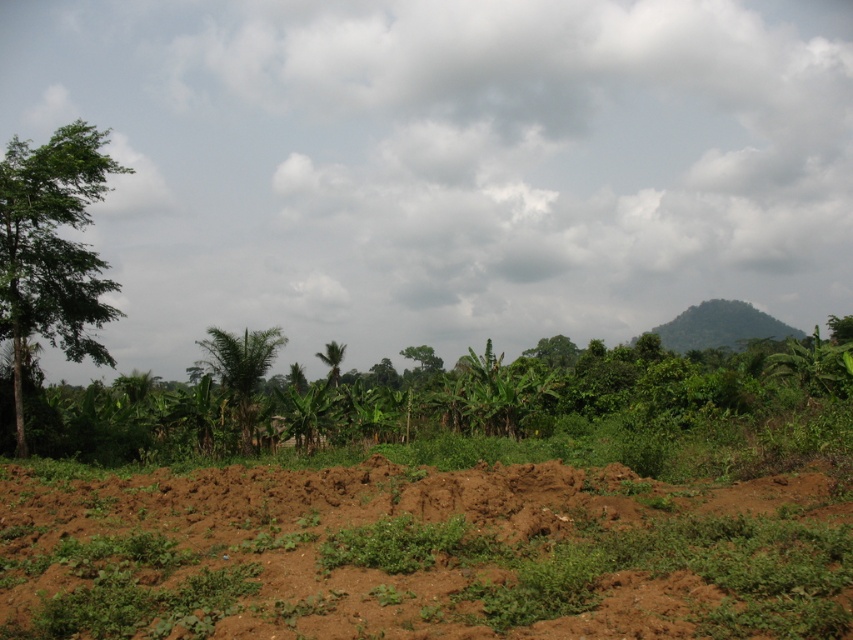
You are a farmer checking your field. You see the brown soil at lower center and the green leafy tree at left. Which one is more to the left?

The green leafy tree at left is more to the left.

You are standing in the rural landscape and want to place a small flag at each of the two points, point (45, 252) and point (250, 417). Which point will have its flag appear closer to you when viewed from your current position?

The flag placed at point (45, 252) will appear closer to you because it is closer to the viewer than point (250, 417) according to the spatial description.

You are a farmer checking the field. You notice the brown soil at lower center and the green leafy palm at center. Which object takes up more space in the image?

The green leafy palm at center takes up more space in the image than the brown soil at lower center because it is larger.